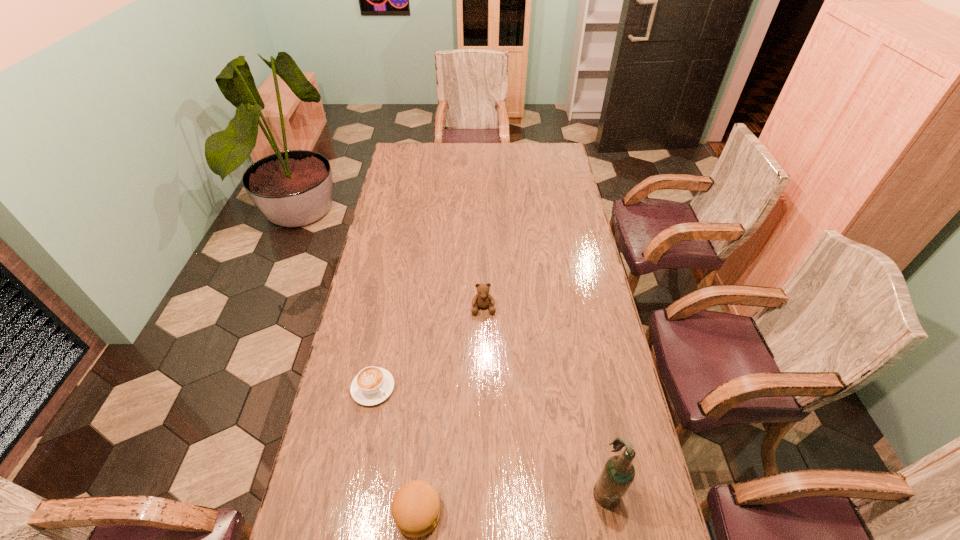
Image resolution: width=960 pixels, height=540 pixels. Find the location of `free space on the desktop that is between the second object from left to right and the beer bottle and is positioned on the side of the leftmost object with the handle`. free space on the desktop that is between the second object from left to right and the beer bottle and is positioned on the side of the leftmost object with the handle is located at coordinates (496, 503).

I want to click on free space on the desktop that is between the second shortest object and the rightmost object and is positioned on the front-facing side of the third shortest object, so coord(496,503).